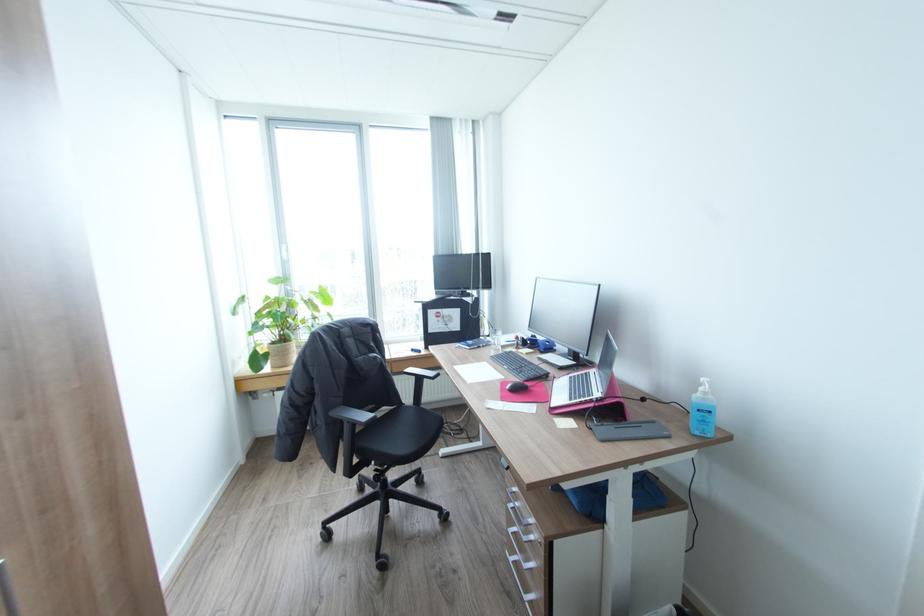
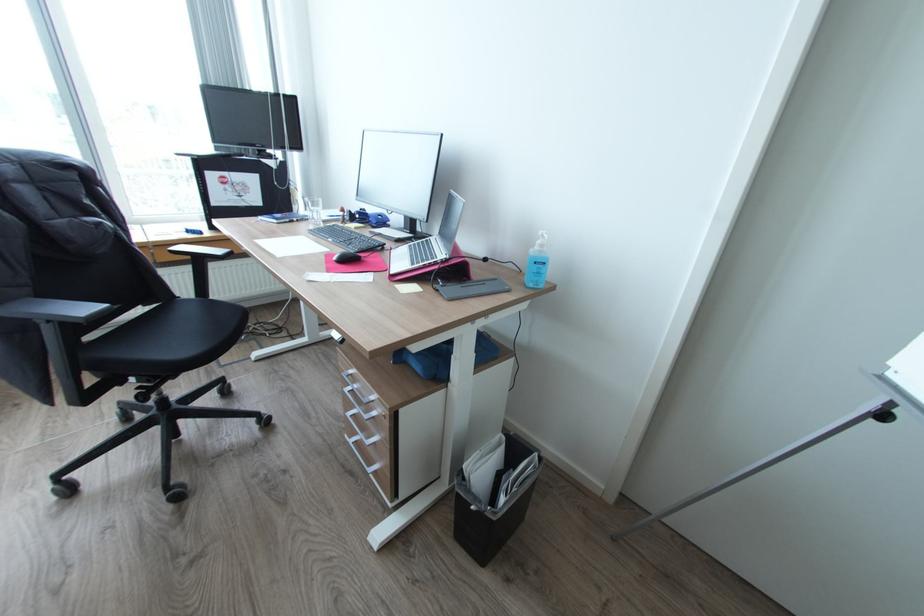
Locate, in the second image, the point that corresponds to (x=502, y=344) in the first image.

(321, 217)